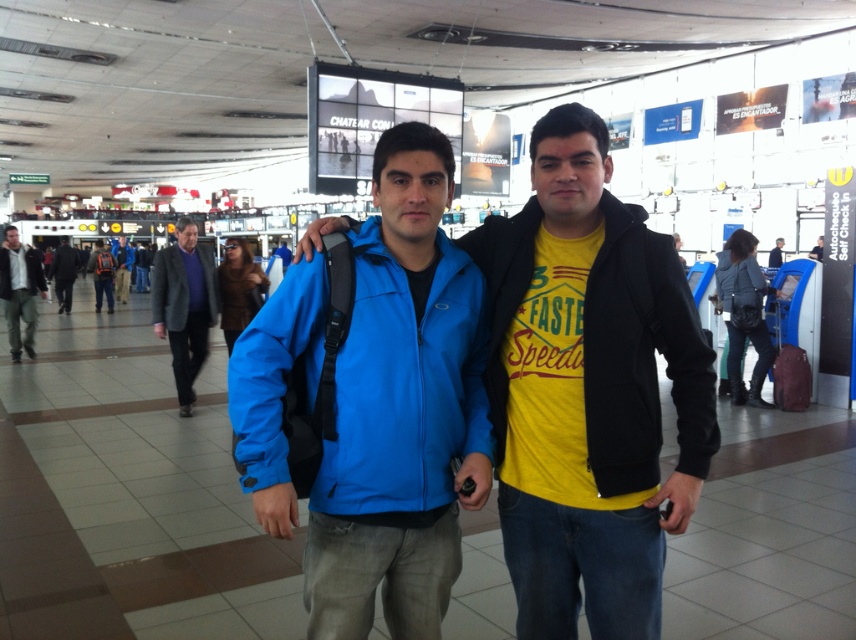
Question: Does blue matte jacket at center have a smaller size compared to dark gray woolen jacket at center?

Choices:
 (A) yes
 (B) no

Answer: (B)

Question: Which point is closer to the camera?

Choices:
 (A) (774, 253)
 (B) (212, 275)
 (C) (13, 275)
 (D) (185, 273)

Answer: (D)

Question: Is blue matte jacket at center to the right of matte black jacket at left from the viewer's perspective?

Choices:
 (A) no
 (B) yes

Answer: (B)

Question: Among these objects, which one is nearest to the camera?

Choices:
 (A) dark blue jacket at center
 (B) matte blue jacket at center

Answer: (B)

Question: Which point is closer to the camera?

Choices:
 (A) (128, 275)
 (B) (308, 396)

Answer: (B)

Question: Observing the image, what is the correct spatial positioning of matte black backpack at center in reference to yellow t-shirt at center?

Choices:
 (A) above
 (B) below

Answer: (A)